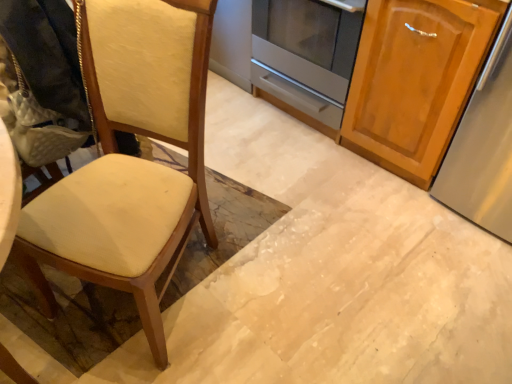
Question: Considering the relative sizes of wooden cabinet at right and matte cream fabric chair at left in the image provided, is wooden cabinet at right taller than matte cream fabric chair at left?

Choices:
 (A) no
 (B) yes

Answer: (A)

Question: Is wooden cabinet at right aimed at matte cream fabric chair at left?

Choices:
 (A) yes
 (B) no

Answer: (A)

Question: Is the surface of wooden cabinet at right in direct contact with matte cream fabric chair at left?

Choices:
 (A) yes
 (B) no

Answer: (B)

Question: Is wooden cabinet at right to the right of matte cream fabric chair at left from the viewer's perspective?

Choices:
 (A) no
 (B) yes

Answer: (B)

Question: Does wooden cabinet at right have a lesser height compared to matte cream fabric chair at left?

Choices:
 (A) yes
 (B) no

Answer: (A)

Question: Would you say wooden cabinet at right is outside matte cream fabric chair at left?

Choices:
 (A) yes
 (B) no

Answer: (A)

Question: Is matte cream fabric chair at left outside satin silver oven at center?

Choices:
 (A) yes
 (B) no

Answer: (A)

Question: Is matte cream fabric chair at left positioned before satin silver oven at center?

Choices:
 (A) no
 (B) yes

Answer: (B)

Question: Is matte cream fabric chair at left facing towards satin silver oven at center?

Choices:
 (A) no
 (B) yes

Answer: (A)

Question: Is matte cream fabric chair at left at the right side of satin silver oven at center?

Choices:
 (A) yes
 (B) no

Answer: (B)

Question: Is matte cream fabric chair at left to the left of satin silver oven at center from the viewer's perspective?

Choices:
 (A) no
 (B) yes

Answer: (B)

Question: Can you confirm if matte cream fabric chair at left is bigger than satin silver oven at center?

Choices:
 (A) yes
 (B) no

Answer: (A)

Question: Considering the relative sizes of wooden cabinet at right and satin silver oven at center in the image provided, is wooden cabinet at right smaller than satin silver oven at center?

Choices:
 (A) yes
 (B) no

Answer: (B)